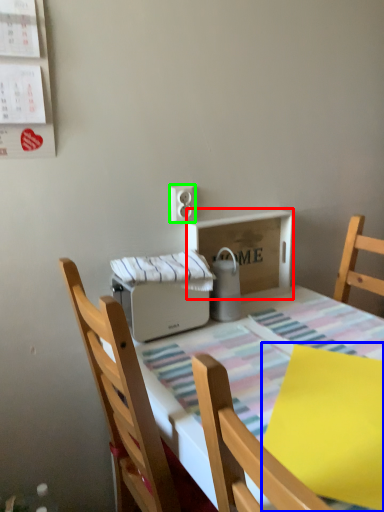
Question: Based on their relative distances, which object is farther from cardboard box (highlighted by a red box)? Choose from sheet (highlighted by a blue box) and electric outlet (highlighted by a green box).

Choices:
 (A) sheet
 (B) electric outlet

Answer: (A)